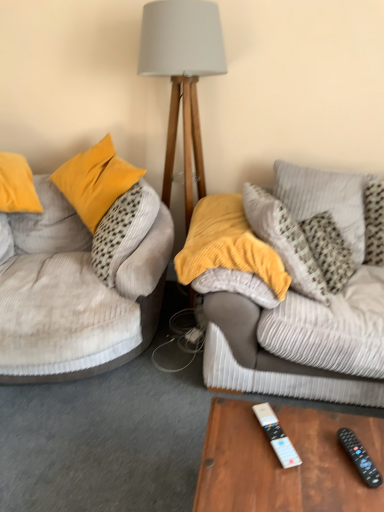
Identify the location of empty space that is in between white plastic remote control at lower center, which is counted as the first remote control, starting from the left, and black plastic remote control at lower right, the first remote control when ordered from right to left. The width and height of the screenshot is (384, 512). (313, 450).